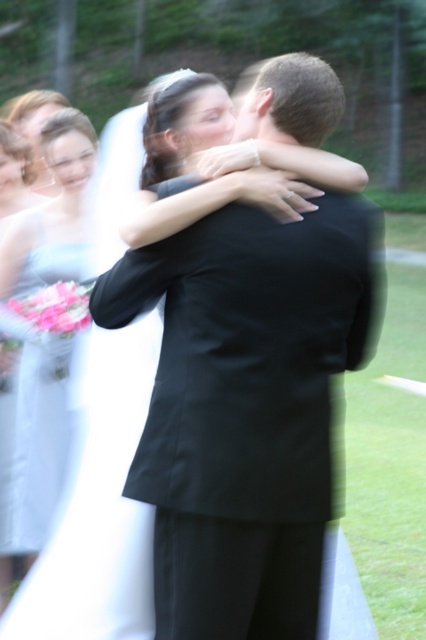
Question: Which is nearer to the black satin suit at center?

Choices:
 (A) matte white dress at left
 (B) white satin dress at left

Answer: (B)

Question: Is black satin suit at center wider than white satin dress at left?

Choices:
 (A) no
 (B) yes

Answer: (B)

Question: Which point is closer to the camera taking this photo?

Choices:
 (A) (17, 205)
 (B) (62, 481)

Answer: (B)

Question: Which point is farther to the camera?

Choices:
 (A) (16, 161)
 (B) (77, 204)
 (C) (241, 300)

Answer: (A)

Question: Does white satin dress at left appear over matte white dress at left?

Choices:
 (A) no
 (B) yes

Answer: (A)

Question: Where is white satin dress at left located in relation to matte white dress at left in the image?

Choices:
 (A) left
 (B) right

Answer: (B)